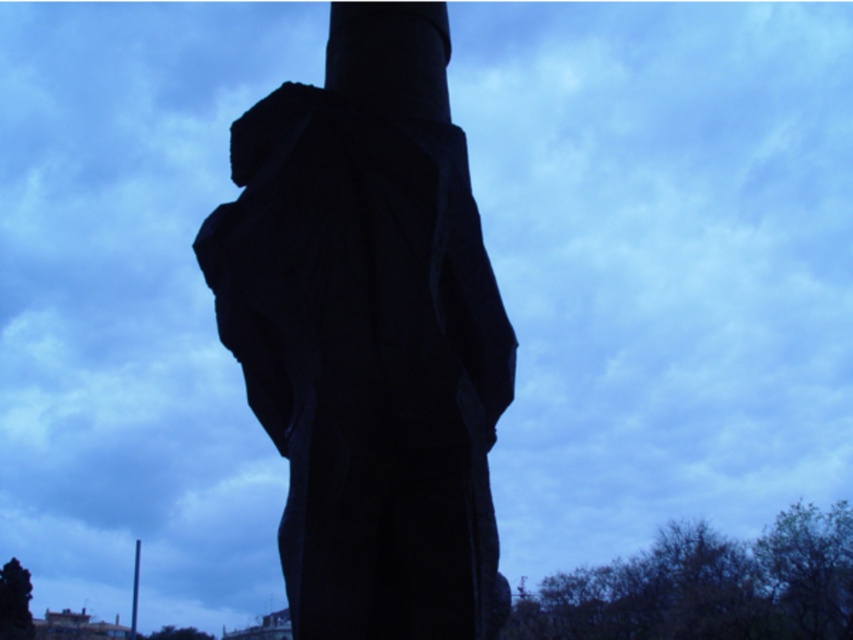
You are standing in front of the dark, textured column and notice two objects at the lower left corner of your view. Which one is positioned more to the left between the dark green tree at lower left and the smooth black pole at lower left?

The dark green tree at lower left is positioned more to the left than the smooth black pole at lower left.

You are standing in front of the column and want to take a photo of the black stone statue at center and the dark green tree at lower left. Which object will appear larger in the photo?

The black stone statue at center will appear larger in the photo because it is in front of the dark green tree at lower left, meaning it is closer to the camera.

You are standing in front of the column and notice two points marked on it. The first point is at coordinates point (352, 416) and the second is at point (131, 628). Which point is nearer to your eyes?

Point (352, 416) is closer to the camera than point (131, 628), so the first point is nearer to your eyes.